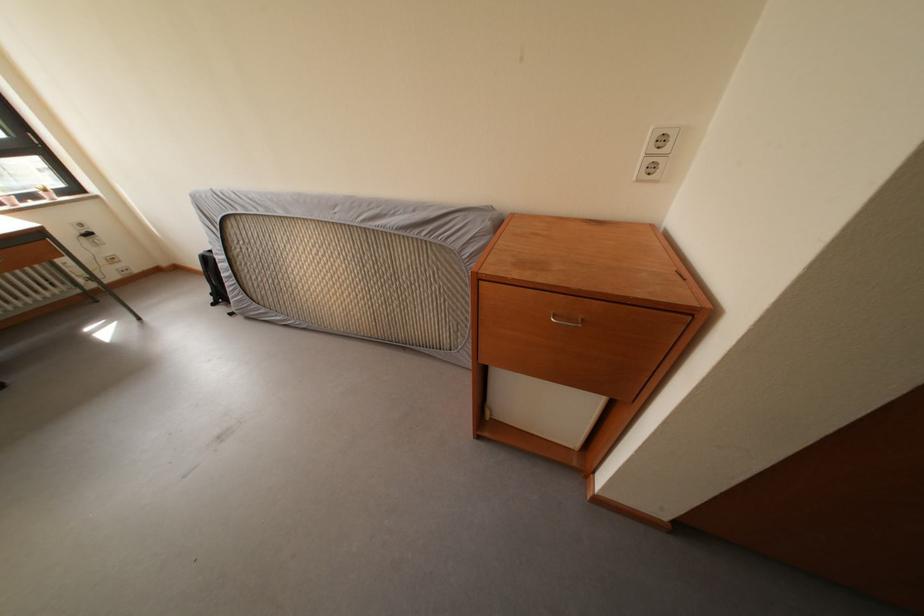
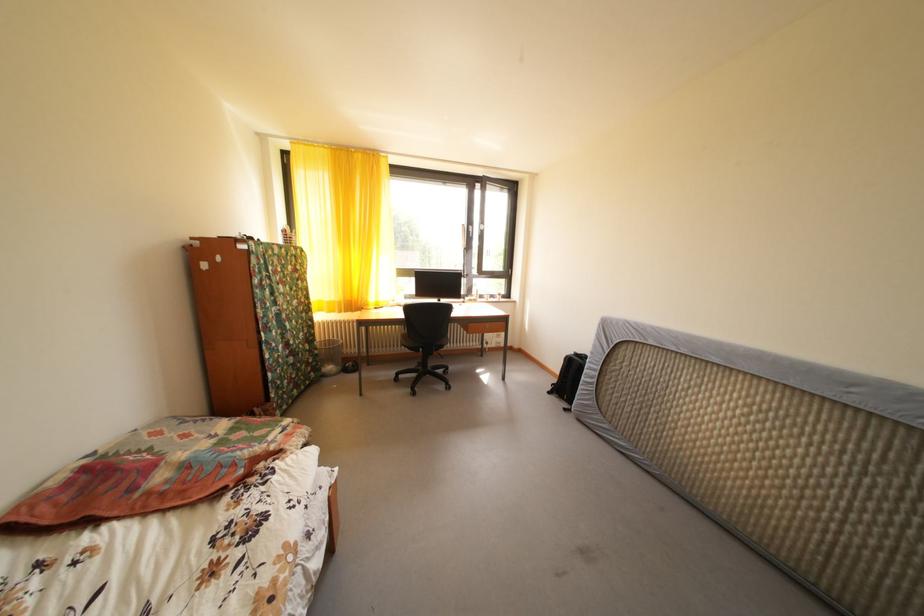
Where in the second image is the point corresponding to pixel 220 306 from the first image?

(558, 394)